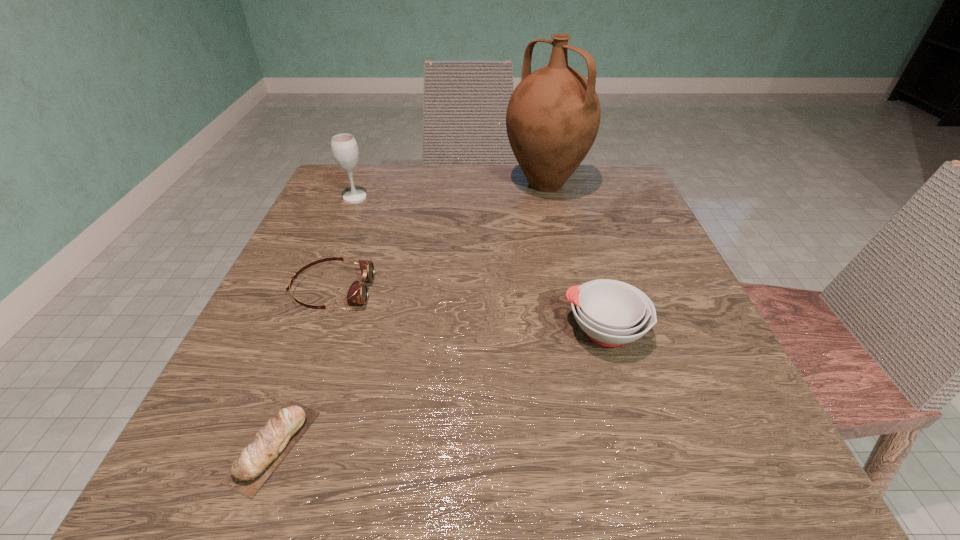
This screenshot has width=960, height=540. I want to click on object located at the near left corner, so click(x=259, y=459).

I want to click on object that is at the far right corner, so click(553, 116).

Locate an element on the screen. The width and height of the screenshot is (960, 540). free spot at the far edge of the desktop is located at coordinates (505, 207).

What are the coordinates of `vacant space at the near edge of the desktop` in the screenshot? It's located at (561, 486).

In the image, there is a desktop. Where is `free space at the left edge`? This screenshot has width=960, height=540. free space at the left edge is located at coordinates (314, 337).

This screenshot has height=540, width=960. I want to click on vacant space at the right edge of the desktop, so click(633, 236).

Locate an element on the screen. vacant position at the far left corner of the desktop is located at coordinates tap(339, 204).

You are a GUI agent. You are given a task and a screenshot of the screen. Output one action in this format:
    pyautogui.click(x=<x>, y=<y>)
    Task: Click on the vacant position at the near left corner of the desktop
    
    Given the screenshot: What is the action you would take?
    pyautogui.click(x=221, y=460)

At what (x,y) coordinates should I click in order to perform the action: click on vacant space at the far right corner of the desktop. Please return your answer as a coordinate pair (x, y). The image size is (960, 540). Looking at the image, I should click on (591, 180).

Identify the location of free space between the pita bread and the third tallest object. The image size is (960, 540). (439, 388).